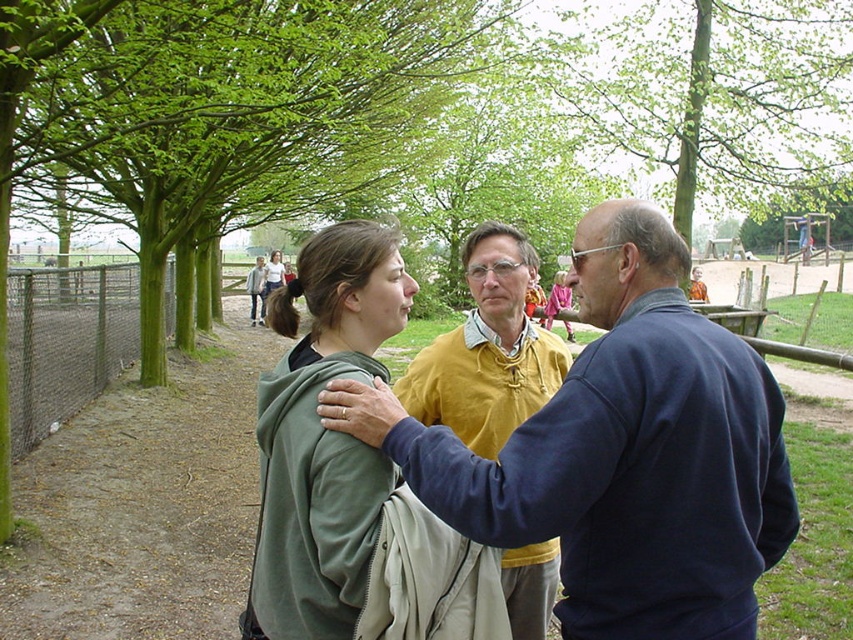
Question: Can you confirm if blue fleece jacket at center is smaller than green matte jacket at center?

Choices:
 (A) yes
 (B) no

Answer: (A)

Question: Can you confirm if yellow knit sweater at center is wider than matte yellow sweater at center?

Choices:
 (A) no
 (B) yes

Answer: (A)

Question: Which point appears farthest from the camera in this image?

Choices:
 (A) [x=256, y=300]
 (B) [x=357, y=602]
 (C) [x=163, y=316]

Answer: (A)

Question: Which object is positioned farthest from the chain-link fence at left?

Choices:
 (A) blue fleece jacket at center
 (B) white cotton shirt at center

Answer: (B)

Question: Based on their relative distances, which object is farther from the green matte jacket at center?

Choices:
 (A) chain-link fence at left
 (B) matte yellow sweater at center

Answer: (B)

Question: Is blue fleece jacket at center smaller than chain-link fence at left?

Choices:
 (A) yes
 (B) no

Answer: (B)